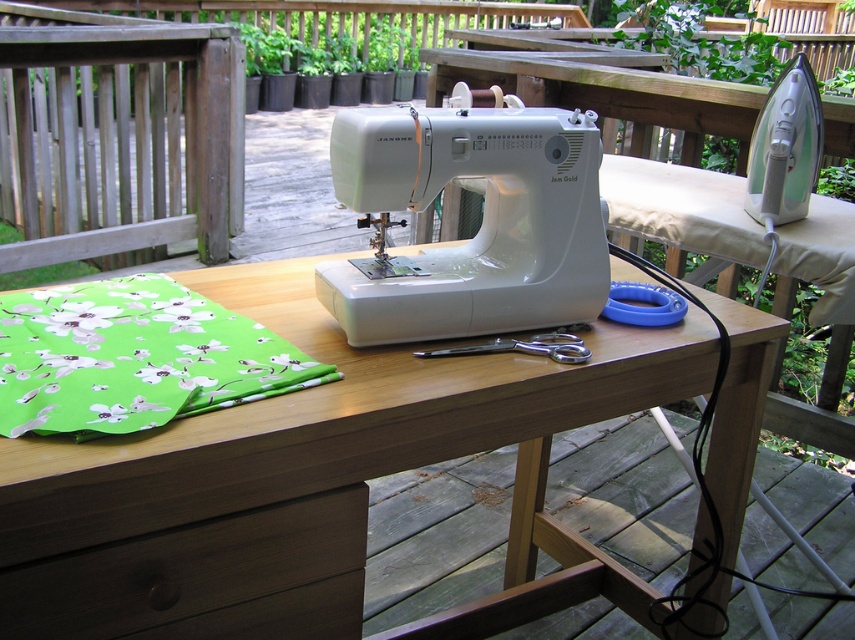
Between white plastic sewing machine at center and dark brown wood drawer at lower left, which one is positioned lower?

dark brown wood drawer at lower left

Find the location of a particular element. The width and height of the screenshot is (855, 640). white plastic sewing machine at center is located at coordinates (481, 225).

Which is in front, point (582, 260) or point (57, 605)?

Point (57, 605) is in front.

You are a GUI agent. You are given a task and a screenshot of the screen. Output one action in this format:
    pyautogui.click(x=<x>, y=<y>)
    Task: Click on the white plastic sewing machine at center
    
    Given the screenshot: What is the action you would take?
    pyautogui.click(x=481, y=225)

Who is taller, wooden table at center or green floral fabric at lower left?

With more height is wooden table at center.

Is point (736, 486) closer to camera compared to point (49, 292)?

No, it is not.

Who is more distant from viewer, (x=12, y=452) or (x=96, y=424)?

Positioned behind is point (x=96, y=424).

Where is `wooden table at center`? This screenshot has height=640, width=855. wooden table at center is located at coordinates (314, 483).

Between wooden table at center and dark brown wood drawer at lower left, which one has more height?

wooden table at center is taller.

Is wooden table at center to the left of dark brown wood drawer at lower left from the viewer's perspective?

Incorrect, wooden table at center is not on the left side of dark brown wood drawer at lower left.

Measure the distance between point (317, 524) and camera.

Point (317, 524) is 34.90 inches away from camera.

Locate an element on the screen. This screenshot has width=855, height=640. wooden table at center is located at coordinates (314, 483).